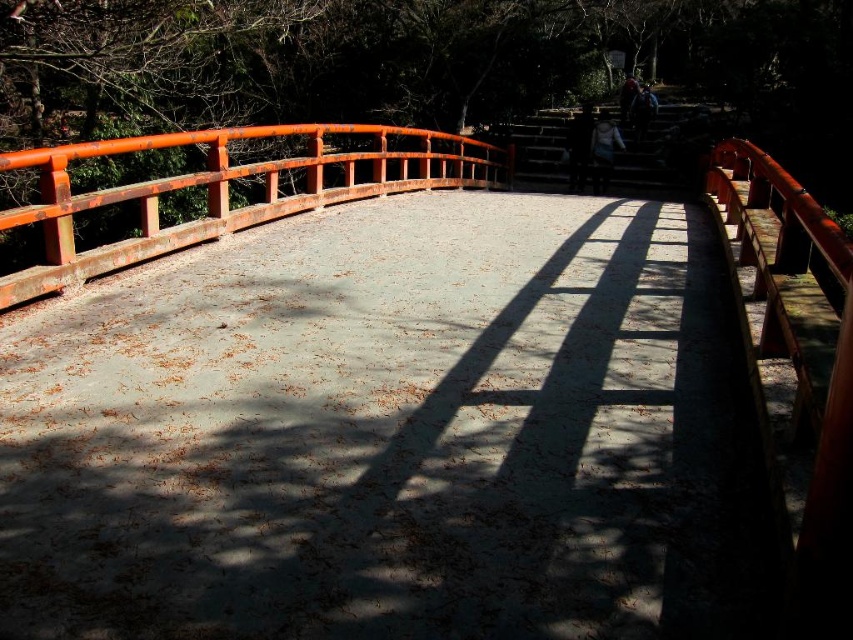
The image size is (853, 640). Describe the element at coordinates (602, 148) in the screenshot. I see `light brown leather jacket at center` at that location.

Find the location of `light brown leather jacket at center`. light brown leather jacket at center is located at coordinates (602, 148).

Locate an element on the screen. Image resolution: width=853 pixels, height=640 pixels. light brown leather jacket at center is located at coordinates 602,148.

Which is more to the right, rustic wood bridge at center or light brown leather jacket at center?

light brown leather jacket at center

Between rustic wood bridge at center and light brown leather jacket at center, which one has more height?

light brown leather jacket at center

Where is `rustic wood bridge at center`? rustic wood bridge at center is located at coordinates (225, 192).

Between rustic wood bridge at center and dark brown leather jacket at upper center, which one has less height?

rustic wood bridge at center

Is rustic wood bridge at center above dark brown leather jacket at upper center?

No, rustic wood bridge at center is not above dark brown leather jacket at upper center.

The width and height of the screenshot is (853, 640). Describe the element at coordinates (225, 192) in the screenshot. I see `rustic wood bridge at center` at that location.

I want to click on rustic wood bridge at center, so click(225, 192).